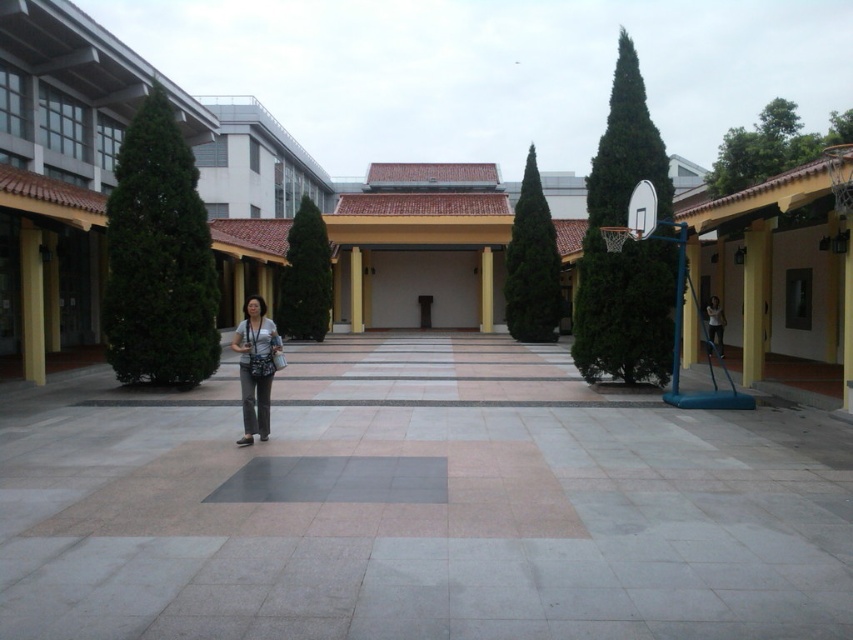
Between matte black camera at center and yellow matte pillar at left, which one has more height?

Standing taller between the two is yellow matte pillar at left.

Does point (252, 310) come behind point (39, 352)?

No, it is not.

I want to click on matte black camera at center, so click(x=254, y=368).

Who is more distant from viewer, (141,515) or (19,276)?

The point (19,276) is more distant.

Is gray concrete courtyard at center closer to the viewer compared to yellow matte pillar at left?

That is True.

Does point (181, 426) come in front of point (21, 276)?

Yes, point (181, 426) is in front of point (21, 276).

The width and height of the screenshot is (853, 640). Find the location of `gray concrete courtyard at center`. gray concrete courtyard at center is located at coordinates (418, 506).

Can you confirm if yellow matte pillar at right is positioned below white glossy pillar at center?

Correct, yellow matte pillar at right is located below white glossy pillar at center.

Between yellow matte pillar at right and white glossy pillar at center, which one has more height?

white glossy pillar at center is taller.

Which is behind, point (757, 326) or point (349, 300)?

The point (349, 300) is more distant.

Find the location of `yellow matte pillar at right`. yellow matte pillar at right is located at coordinates (753, 300).